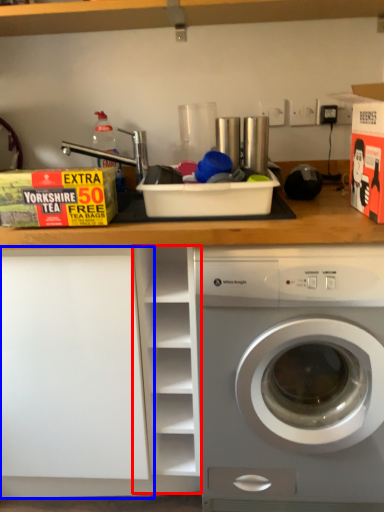
Question: Among these objects, which one is nearest to the camera, cabinet (highlighted by a red box) or shelf (highlighted by a blue box)?

Choices:
 (A) cabinet
 (B) shelf

Answer: (A)